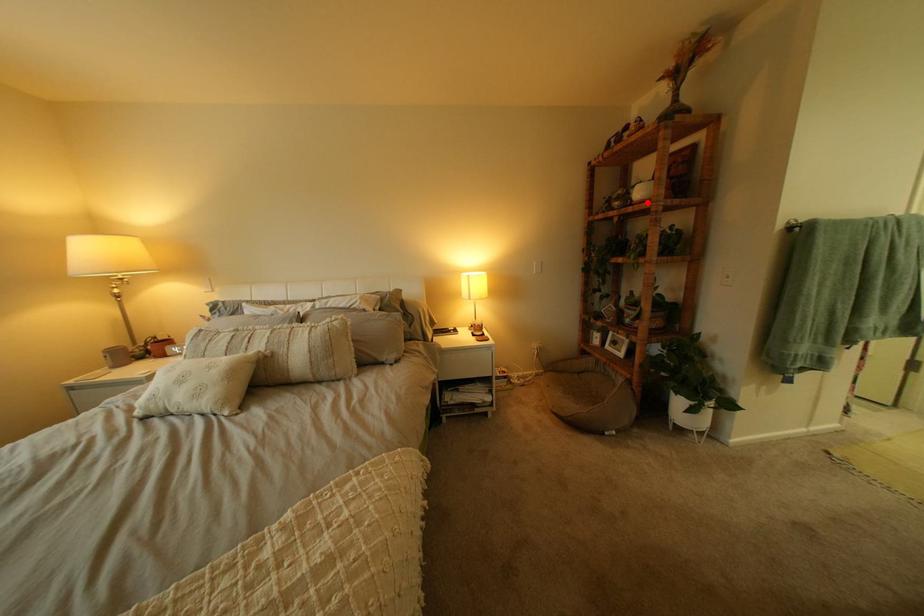
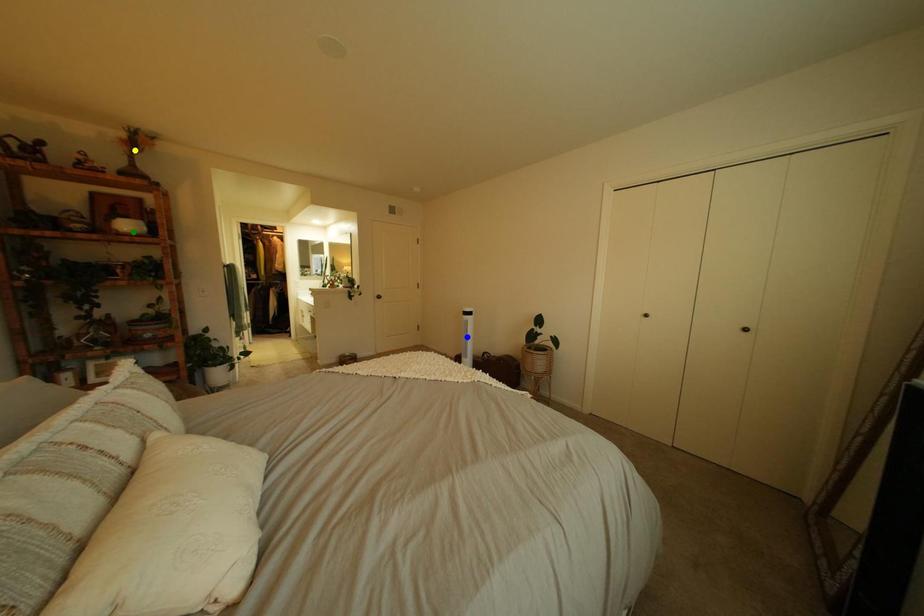
Question: I am providing you with two images of the same scene from different viewpoints. A red point is marked on the first image. You are given multiple points on the second image. Which point in image 2 is actually the same real-world point as the red point in image 1?

Choices:
 (A) yellow point
 (B) green point
 (C) blue point

Answer: (B)